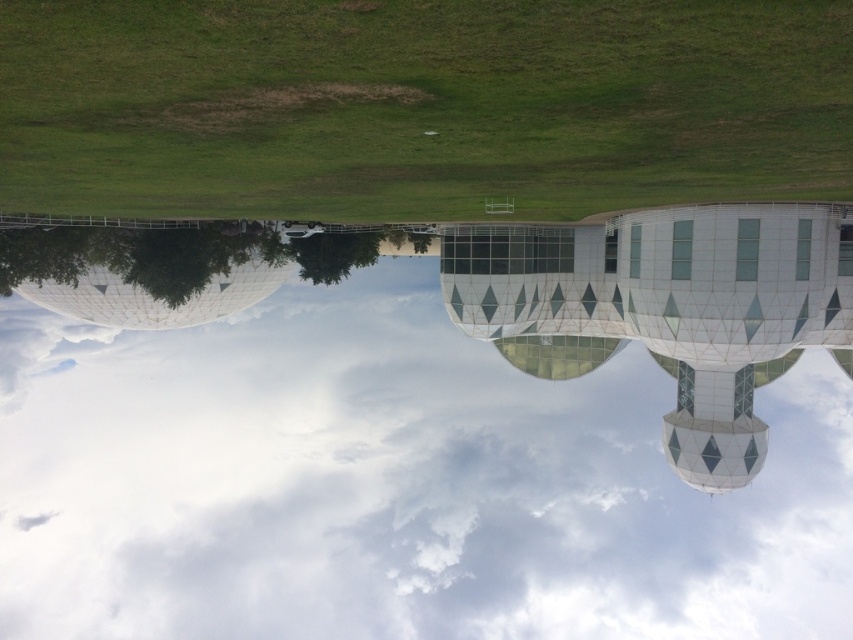
You are a photographer planning to capture the modern architectural structure with its surroundings. You notice the white cloud at upper center and the green grass at center in your frame. Which object would you focus on first if you want to emphasize the larger element in the scene?

The white cloud at upper center is bigger than the green grass at center, so you should focus on the white cloud at upper center first to emphasize the larger element in the scene.

You are standing in front of the modern architectural structure and looking at the sky. Which object, the white cloud at upper center or the green grass at center, is positioned to the right of the other?

The white cloud at upper center is positioned to the right of the green grass at center.

In the scene shown: You are standing in front of the modern architectural structure and looking at the sky. There is a point marked at coordinates point (x=370, y=461). What is located at that point?

The point (x=370, y=461) indicates a white cloud at upper center.